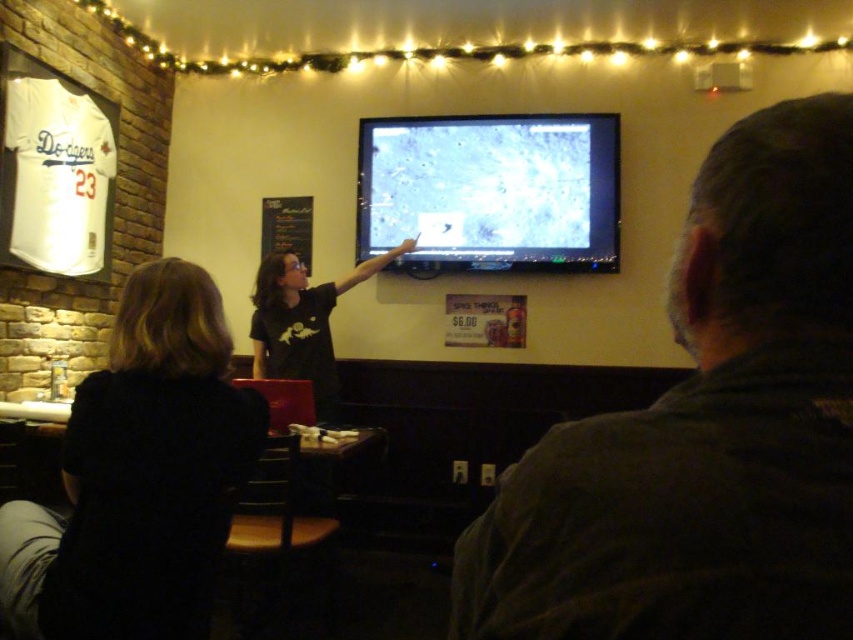
You are standing in the room and want to place a new poster exactly at the center of the wall where the dark brown leather jacket at upper right is currently hanging. What coordinates should you aim for?

The dark brown leather jacket at upper right is currently at coordinates point [705,429], so you should aim for those coordinates to place the new poster at the same spot.

You are a delivery person who needs to place a dark brown leather jacket at upper right on a shelf that is 12 feet away from the matte plastic screen at center. Based on the scene, can you confirm if the jacket will fit on the shelf?

The distance between the dark brown leather jacket at upper right and the matte plastic screen at center is 11.45 feet, which is less than the required 12 feet. Therefore, the jacket will not fit on the shelf.

Based on the photo, you are a guest at this event and want to take a photo of the presenter. The presenter is standing near the TV, but you need to avoid blocking the dark brown leather jacket at upper right and the black fabric shirt at lower left. Which object should you position yourself to the left of to ensure both are visible in your photo?

You should position yourself to the left of the dark brown leather jacket at upper right. Since the dark brown leather jacket at upper right is to the right of the black fabric shirt at lower left, placing yourself to its left would keep both objects in frame without blocking them.